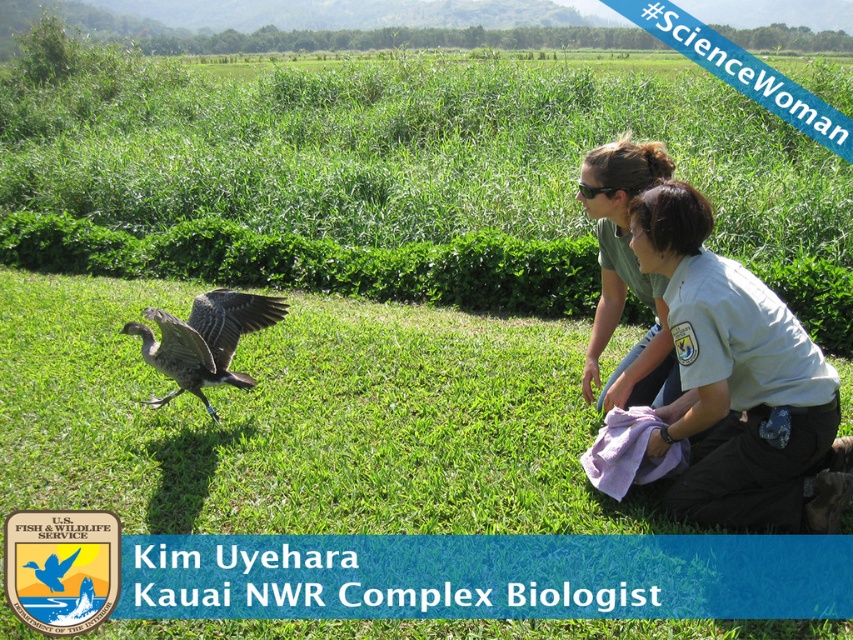
Does green matte shirt at center have a smaller size compared to gray feathered goose at center?

Actually, green matte shirt at center might be larger than gray feathered goose at center.

Describe the element at coordinates (625, 275) in the screenshot. I see `green matte shirt at center` at that location.

Is point (602, 336) closer to camera compared to point (181, 346)?

No, it is not.

Locate an element on the screen. green matte shirt at center is located at coordinates (625, 275).

Measure the distance from light gray uniform at center to gray feathered goose at center.

A distance of 8.27 feet exists between light gray uniform at center and gray feathered goose at center.

How distant is light gray uniform at center from gray feathered goose at center?

light gray uniform at center is 2.52 meters from gray feathered goose at center.

This screenshot has height=640, width=853. What do you see at coordinates (740, 384) in the screenshot? I see `light gray uniform at center` at bounding box center [740, 384].

At what (x,y) coordinates should I click in order to perform the action: click on light gray uniform at center. Please return your answer as a coordinate pair (x, y). Looking at the image, I should click on (740, 384).

How distant is light gray uniform at center from green matte shirt at center?

A distance of 23.26 inches exists between light gray uniform at center and green matte shirt at center.

The width and height of the screenshot is (853, 640). Describe the element at coordinates (740, 384) in the screenshot. I see `light gray uniform at center` at that location.

This screenshot has width=853, height=640. In order to click on light gray uniform at center in this screenshot , I will do `click(740, 384)`.